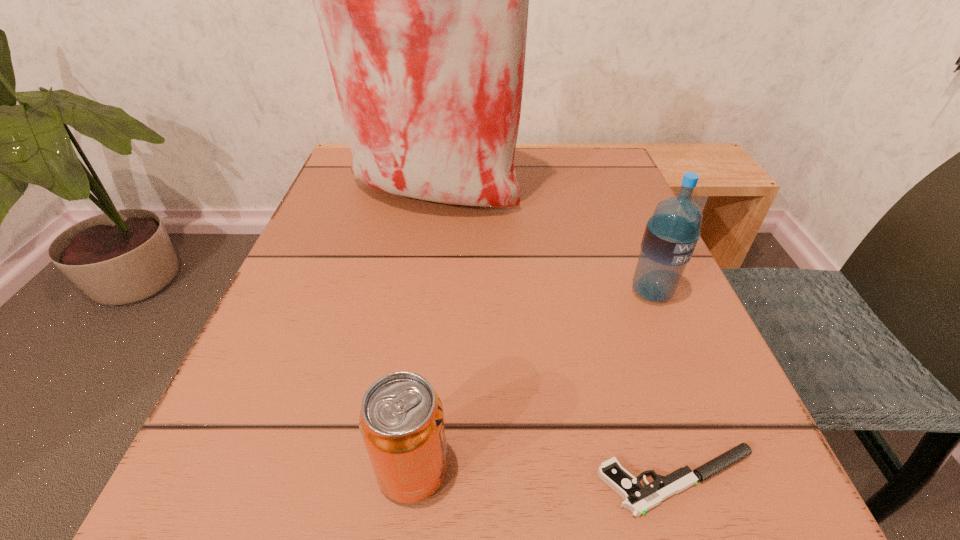
This screenshot has height=540, width=960. What are the coordinates of `empty space between the shortest object and the third tallest object` in the screenshot? It's located at (546, 475).

The width and height of the screenshot is (960, 540). I want to click on free spot between the water bottle and the shortest object, so click(x=665, y=387).

Identify the location of vacant point located between the third shortest object and the farthest object. This screenshot has height=540, width=960. (540, 244).

The width and height of the screenshot is (960, 540). Identify the location of free point between the pistol and the second shortest object. (546, 475).

The width and height of the screenshot is (960, 540). What are the coordinates of `free space between the third shortest object and the pistol` in the screenshot? It's located at (665, 387).

Locate an element on the screen. vacant space in between the second shortest object and the water bottle is located at coordinates (532, 381).

This screenshot has width=960, height=540. Identify the location of object identified as the closest to the third tallest object. (638, 499).

Where is `the second closest object to the second farthest object`? This screenshot has width=960, height=540. the second closest object to the second farthest object is located at coordinates [638, 499].

At what (x,y) coordinates should I click in order to perform the action: click on vacant space that satisfies the following two spatial constraints: 1. on the front side of the third tallest object; 2. on the left side of the farthest object. Please return your answer as a coordinate pair (x, y). Looking at the image, I should click on (386, 469).